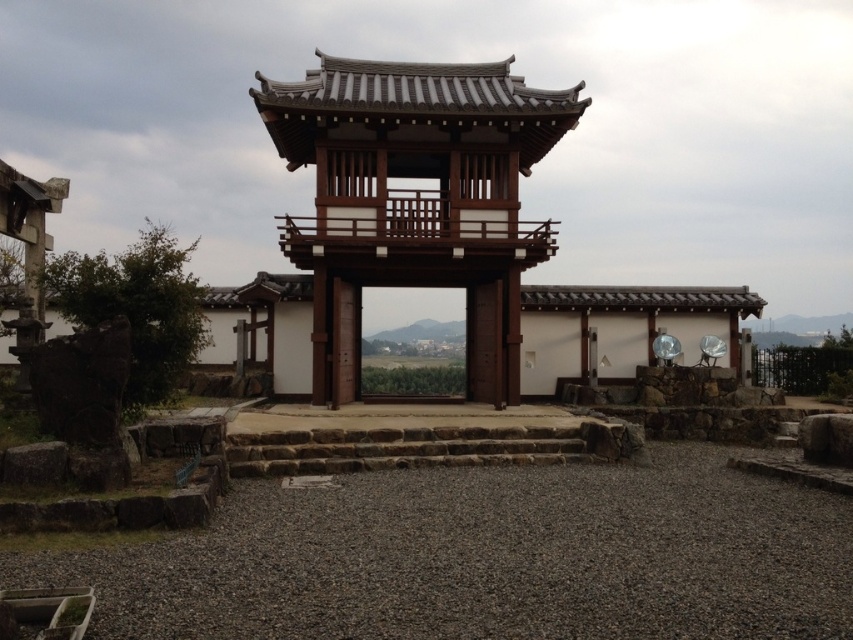
Question: Where is gray gravel at center located in relation to brown stone stairs at center in the image?

Choices:
 (A) left
 (B) right

Answer: (B)

Question: Does gray gravel at center have a larger size compared to brown stone stairs at center?

Choices:
 (A) no
 (B) yes

Answer: (B)

Question: Which point appears closest to the camera in this image?

Choices:
 (A) (508, 243)
 (B) (248, 570)
 (C) (332, 440)

Answer: (B)

Question: Is gray gravel at center in front of brown wooden gazebo at center?

Choices:
 (A) yes
 (B) no

Answer: (A)

Question: Among these points, which one is nearest to the camera?

Choices:
 (A) (276, 568)
 (B) (323, 470)
 (C) (274, 134)

Answer: (A)

Question: Which point is farther to the camera?

Choices:
 (A) brown wooden gazebo at center
 (B) brown stone stairs at center

Answer: (A)